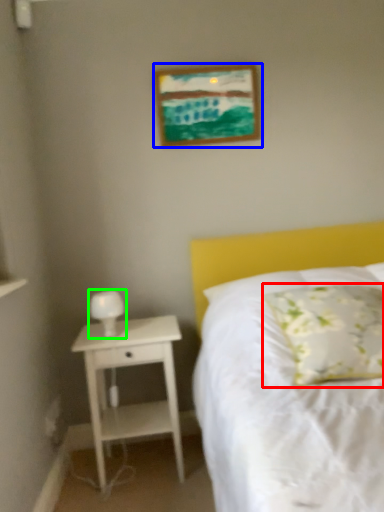
Question: Which object is the farthest from pillow (highlighted by a red box)? Choose among these: picture frame (highlighted by a blue box) or bedside lamp (highlighted by a green box).

Choices:
 (A) picture frame
 (B) bedside lamp

Answer: (A)